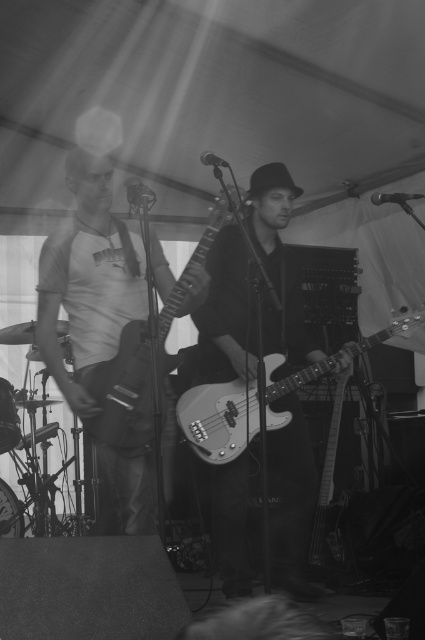
Question: Can you confirm if metallic bass guitar at center is wider than matte black bass at center?

Choices:
 (A) yes
 (B) no

Answer: (A)

Question: Where is metallic bass guitar at center located in relation to matte white t-shirt at left in the image?

Choices:
 (A) above
 (B) below

Answer: (B)

Question: Estimate the real-world distances between objects in this image. Which object is farther from the matte white t-shirt at left?

Choices:
 (A) matte black bass at center
 (B) metallic silver bass guitar at center

Answer: (B)

Question: Does metallic bass guitar at center have a larger size compared to matte white t-shirt at left?

Choices:
 (A) no
 (B) yes

Answer: (B)

Question: Based on their relative distances, which object is nearer to the metallic bass guitar at center?

Choices:
 (A) metallic silver bass guitar at center
 (B) matte white t-shirt at left
 (C) matte black bass at center

Answer: (A)

Question: Which of the following is the farthest from the observer?

Choices:
 (A) (206, 460)
 (B) (150, 518)

Answer: (A)